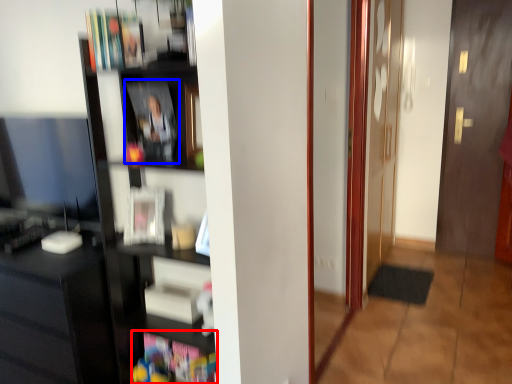
Question: Which object appears farthest to the camera in this image, book (highlighted by a red box) or book (highlighted by a blue box)?

Choices:
 (A) book
 (B) book

Answer: (A)